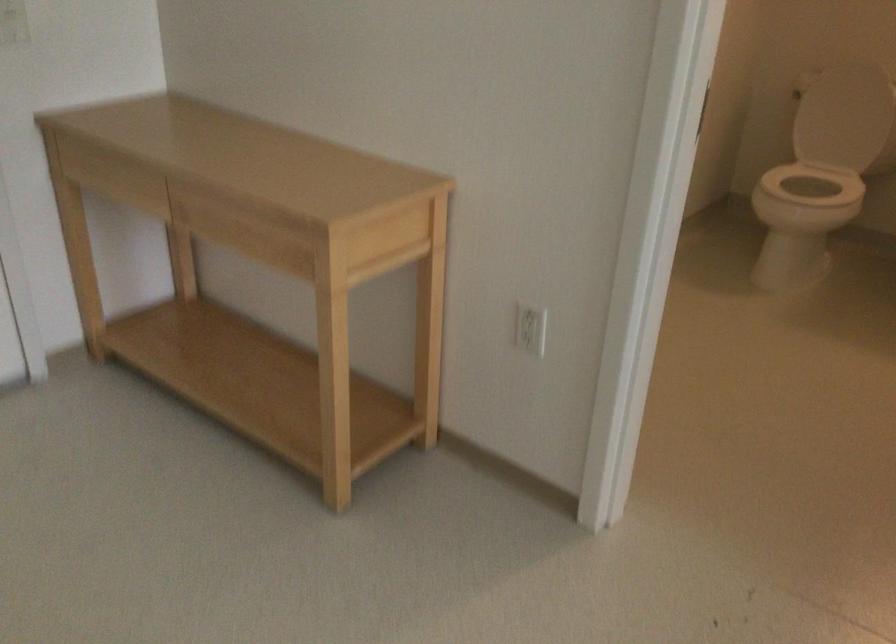
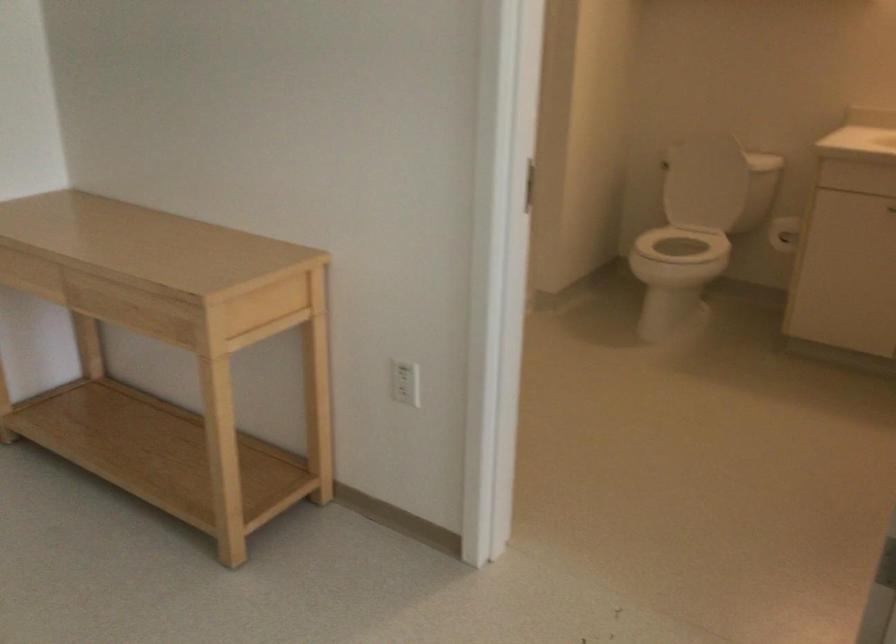
The images are taken continuously from a first-person perspective. In which direction are you moving?

The cameraman moved toward right, backward.